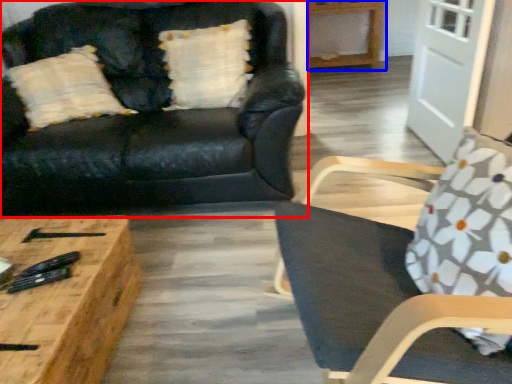
Question: Which point is closer to the camera, studio couch (highlighted by a red box) or hardwood (highlighted by a blue box)?

Choices:
 (A) studio couch
 (B) hardwood

Answer: (A)